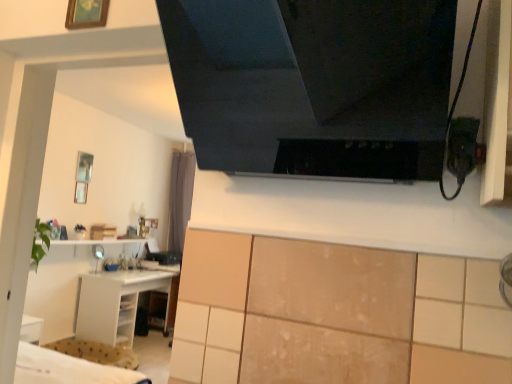
Question: From a real-world perspective, is white glossy shelf at lower left on top of wooden picture frame at upper left, acting as the second picture frame starting from the bottom?

Choices:
 (A) yes
 (B) no

Answer: (B)

Question: Is white glossy shelf at lower left to the left of wooden picture frame at upper left, the 1th picture frame viewed from the top, from the viewer's perspective?

Choices:
 (A) yes
 (B) no

Answer: (A)

Question: From the image's perspective, is white glossy shelf at lower left beneath wooden picture frame at upper left, acting as the 1th picture frame starting from the front?

Choices:
 (A) no
 (B) yes

Answer: (B)

Question: Could you tell me if white glossy shelf at lower left is facing wooden picture frame at upper left, acting as the 1th picture frame starting from the front?

Choices:
 (A) yes
 (B) no

Answer: (B)

Question: Can you confirm if white glossy shelf at lower left is wider than wooden picture frame at upper left, acting as the second picture frame starting from the bottom?

Choices:
 (A) no
 (B) yes

Answer: (B)

Question: Relative to wooden picture frame at upper left, acting as the 1th picture frame starting from the front, is white glossy shelf at lower left in front or behind?

Choices:
 (A) front
 (B) behind

Answer: (B)

Question: Is white glossy shelf at lower left to the left or to the right of wooden picture frame at upper left, which is the 1th picture frame in right-to-left order, in the image?

Choices:
 (A) right
 (B) left

Answer: (B)

Question: Considering the positions of white glossy shelf at lower left and wooden picture frame at upper left, marked as the second picture frame in a back-to-front arrangement, in the image, is white glossy shelf at lower left wider or thinner than wooden picture frame at upper left, marked as the second picture frame in a back-to-front arrangement,?

Choices:
 (A) wide
 (B) thin

Answer: (A)

Question: From their relative heights in the image, would you say white glossy shelf at lower left is taller or shorter than wooden picture frame at upper left, the 2th picture frame in the left-to-right sequence?

Choices:
 (A) short
 (B) tall

Answer: (B)

Question: From the image's perspective, is black glossy exhaust hood at upper center located above or below metallic silver picture frame at upper left, which is counted as the 2th picture frame, starting from the front?

Choices:
 (A) above
 (B) below

Answer: (A)

Question: Considering their positions, is black glossy exhaust hood at upper center located in front of or behind metallic silver picture frame at upper left, positioned as the 2th picture frame in top-to-bottom order?

Choices:
 (A) behind
 (B) front

Answer: (B)

Question: From a real-world perspective, is black glossy exhaust hood at upper center positioned above or below metallic silver picture frame at upper left, positioned as the 2th picture frame in top-to-bottom order?

Choices:
 (A) above
 (B) below

Answer: (A)

Question: Is point (327, 1) closer or farther from the camera than point (77, 190)?

Choices:
 (A) closer
 (B) farther

Answer: (A)

Question: In terms of width, does white glossy shelf at lower left look wider or thinner when compared to metallic silver picture frame at upper left, placed as the first picture frame when sorted from left to right?

Choices:
 (A) wide
 (B) thin

Answer: (A)

Question: From a real-world perspective, is white glossy shelf at lower left positioned above or below metallic silver picture frame at upper left, the 2th picture frame positioned from the right?

Choices:
 (A) above
 (B) below

Answer: (B)